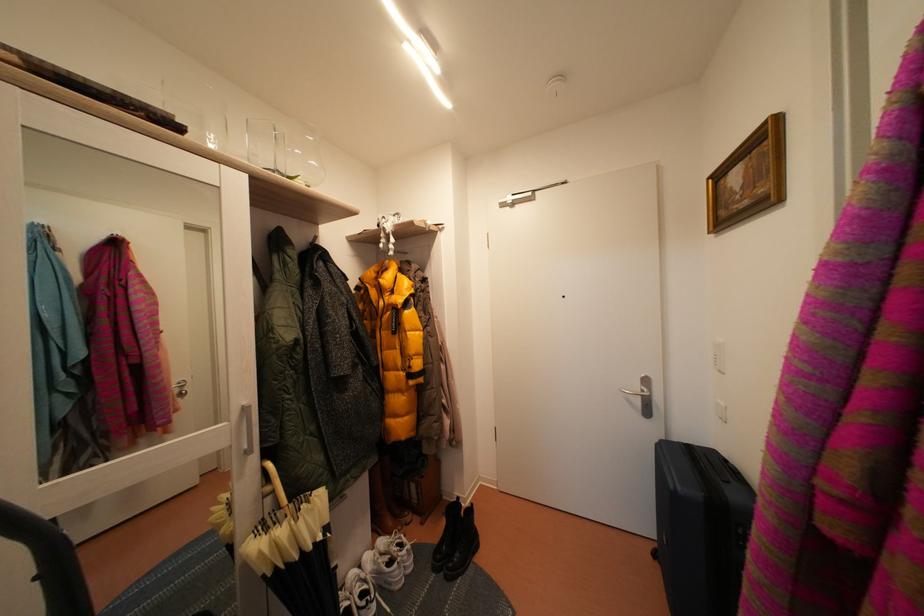
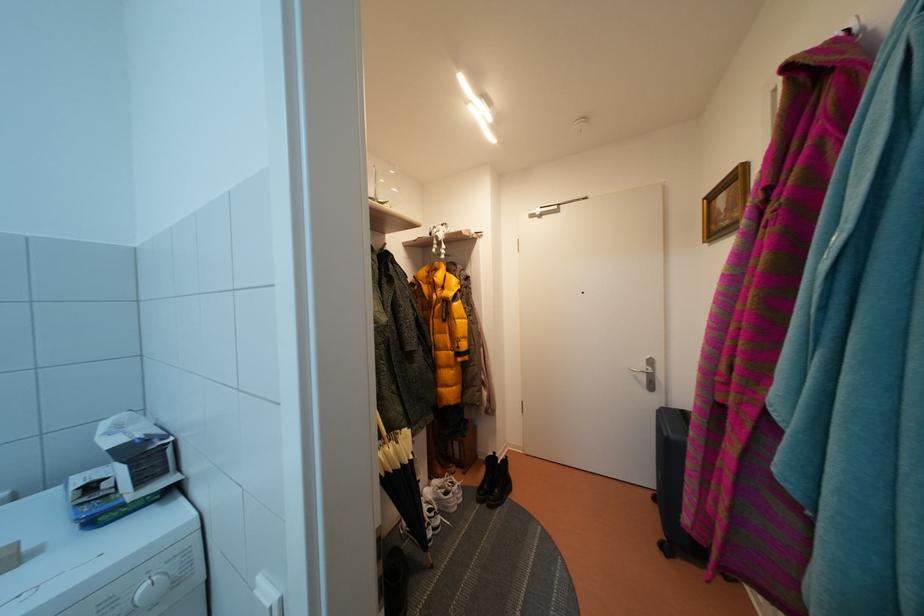
Locate, in the second image, the point that corresponds to the point at 645,392 in the first image.

(650, 371)